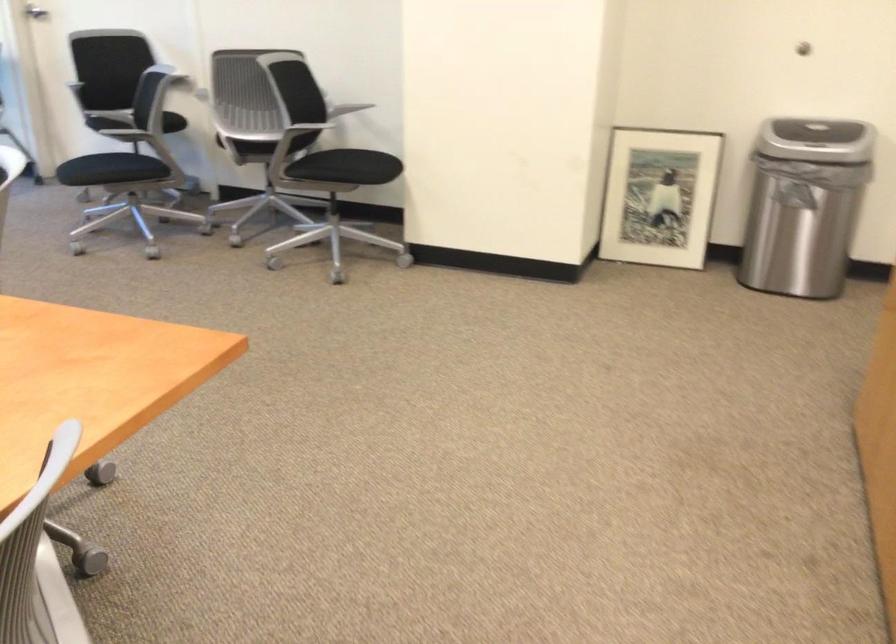
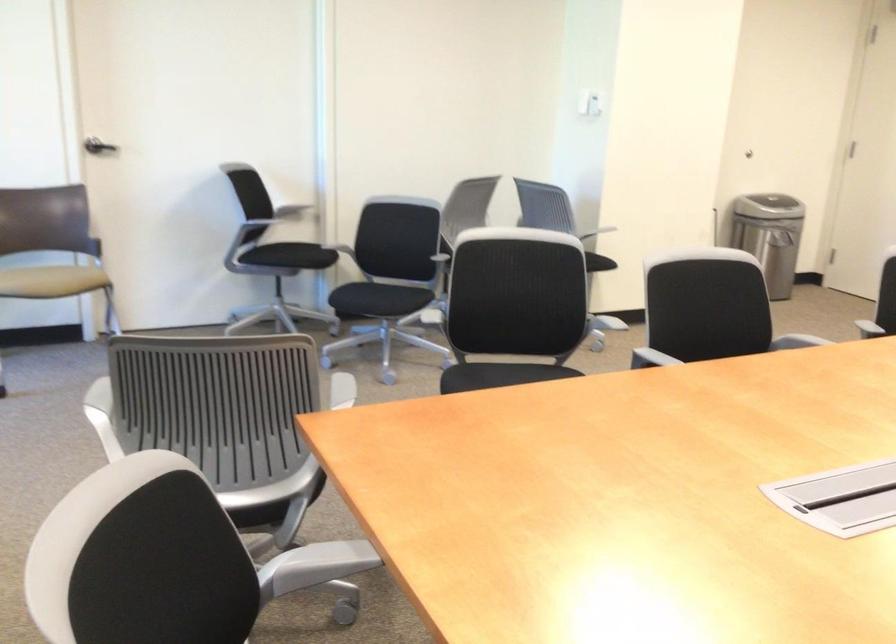
Question: I am providing you with two images of the same scene from different viewpoints. Please identify which objects are invisible in image2.

Choices:
 (A) trash can lid
 (B) chair armrest
 (C) blue plastic clog
 (D) framed picture

Answer: (D)